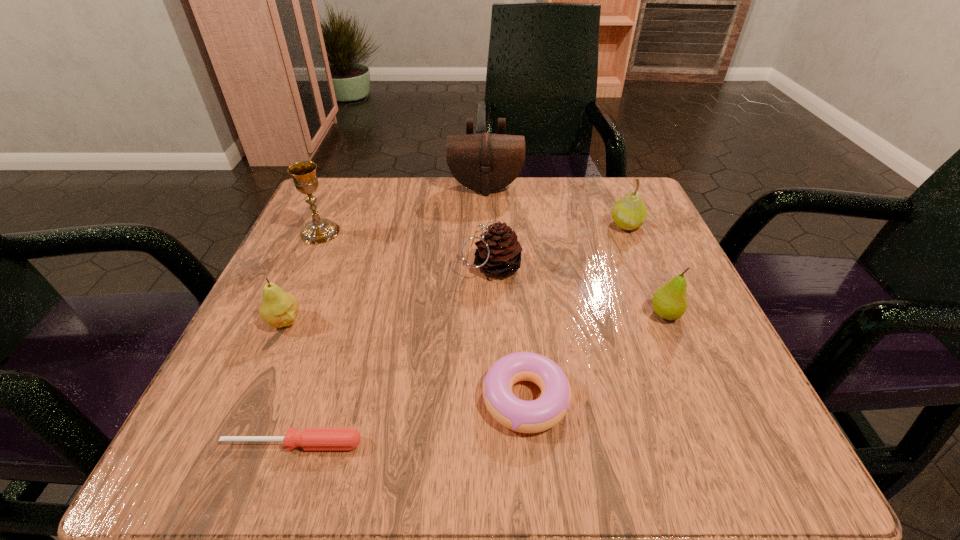
Identify the location of vacant space at the far left corner of the desktop. (335, 186).

Locate an element on the screen. Image resolution: width=960 pixels, height=540 pixels. free region at the near left corner is located at coordinates [210, 459].

In the image, there is a desktop. Find the location of `vacant space at the far right corner`. vacant space at the far right corner is located at coordinates (591, 213).

Identify the location of vacant region at the near right corner of the desktop. (703, 430).

Identify the location of empty space between the chalice and the farthest pear. This screenshot has width=960, height=540. (473, 228).

Locate an element on the screen. free spot between the screwdriver and the farthest pear is located at coordinates (460, 334).

Image resolution: width=960 pixels, height=540 pixels. Find the location of `vacant space in between the farthest pear and the seventh tallest object`. vacant space in between the farthest pear and the seventh tallest object is located at coordinates (576, 312).

Identify the location of unoccupied area between the doughnut and the farthest pear. (576, 312).

This screenshot has height=540, width=960. I want to click on free space between the pinecone and the leftmost pear, so click(388, 294).

At what (x,y) coordinates should I click in order to perform the action: click on free space between the leftmost pear and the farthest pear. Please return your answer as a coordinate pair (x, y). Looking at the image, I should click on (455, 273).